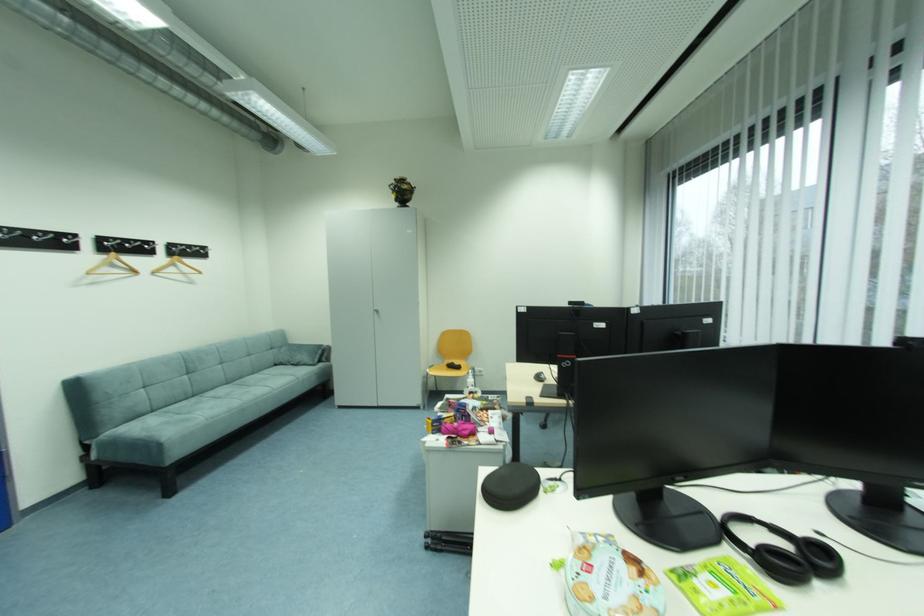
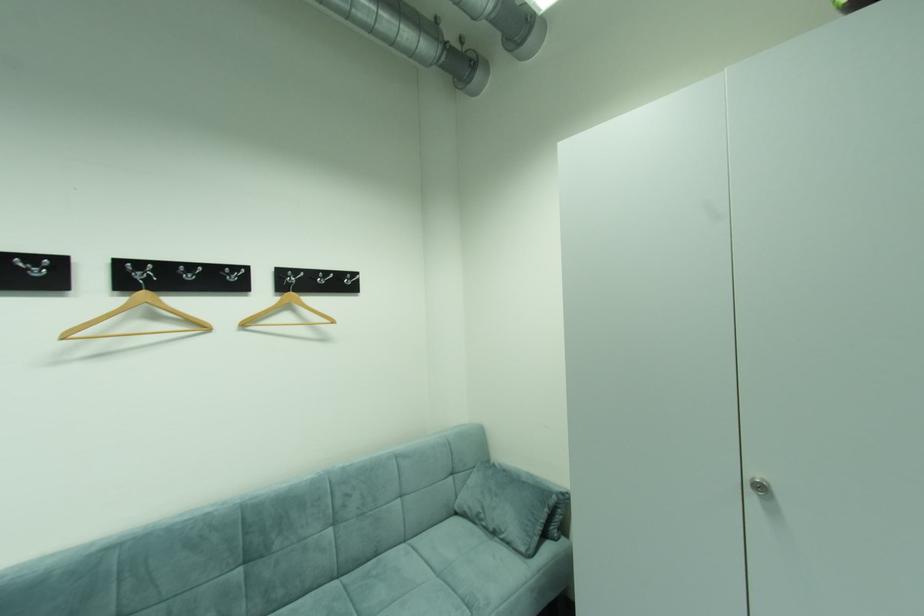
Where in the second image is the point corresponding to point 161,274 from the first image?

(251, 326)